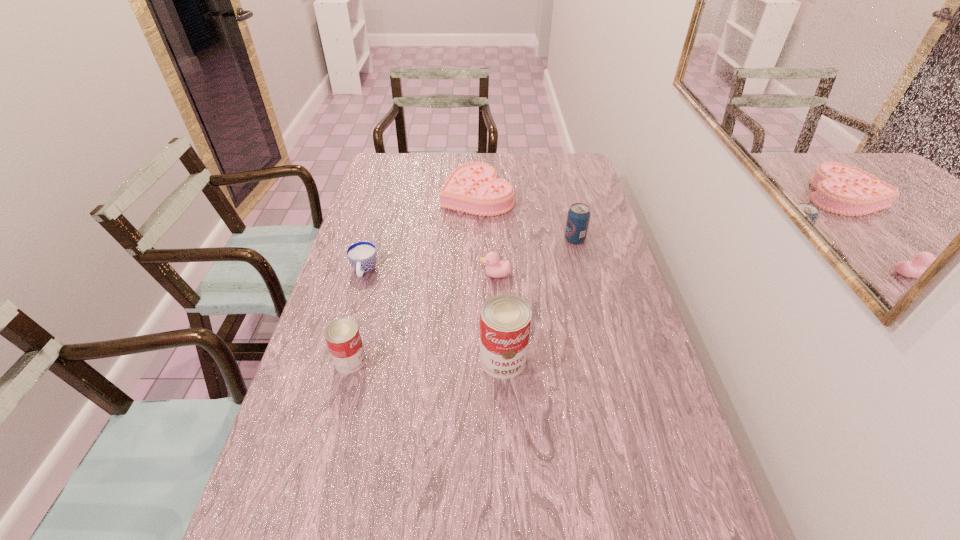
Find the location of a particular element. The width and height of the screenshot is (960, 540). free space located 0.130m on the back of the farthest object is located at coordinates (477, 161).

Find the location of `vacant position located on the front of the fifth nearest object`. vacant position located on the front of the fifth nearest object is located at coordinates (593, 315).

This screenshot has height=540, width=960. Identify the location of vacant area situated on the front-facing side of the duckling. (368, 275).

At what (x,y) coordinates should I click in order to perform the action: click on blank area located 0.120m on the front-facing side of the duckling. Please return your answer as a coordinate pair (x, y). This screenshot has width=960, height=540. Looking at the image, I should click on (442, 275).

Image resolution: width=960 pixels, height=540 pixels. In order to click on free location located 0.110m on the front-facing side of the duckling in this screenshot , I will do `click(444, 275)`.

Image resolution: width=960 pixels, height=540 pixels. Identify the location of free spot located 0.070m on the side of the cup with the handle. (356, 300).

At what (x,y) coordinates should I click in order to perform the action: click on object situated at the far edge. Please return your answer as a coordinate pair (x, y). This screenshot has width=960, height=540. Looking at the image, I should click on (473, 188).

Identify the location of can located in the left edge section of the desktop. This screenshot has width=960, height=540. (342, 336).

Find the location of a particular element. This screenshot has height=540, width=960. cup that is at the left edge is located at coordinates (362, 255).

Where is `object positioned at the right edge`? object positioned at the right edge is located at coordinates (578, 217).